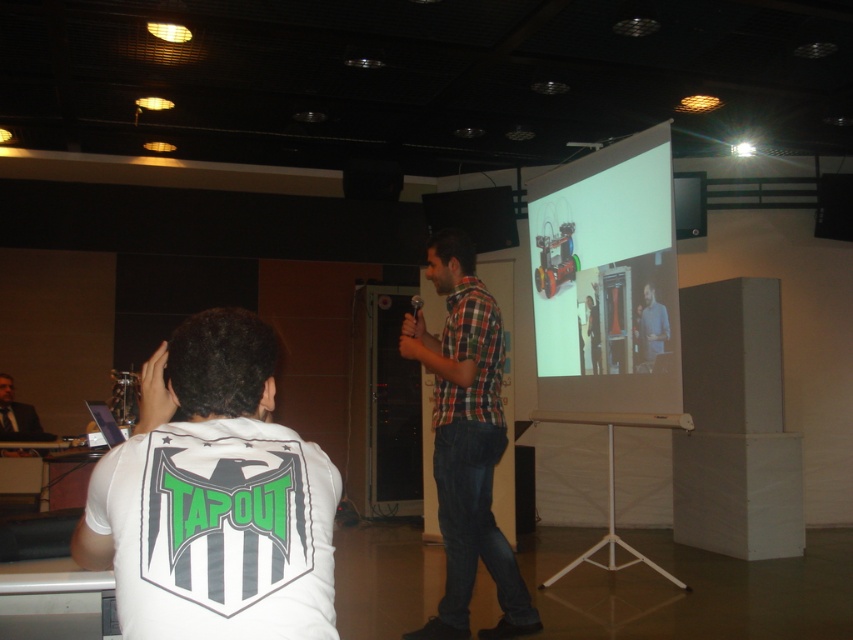
Does white matte projection screen at upper right have a smaller size compared to checkered fabric shirt at center?

No, white matte projection screen at upper right is not smaller than checkered fabric shirt at center.

Who is taller, white matte projection screen at upper right or checkered fabric shirt at center?

checkered fabric shirt at center is taller.

Where is `white matte projection screen at upper right`? white matte projection screen at upper right is located at coordinates (606, 280).

Identify the location of white matte projection screen at upper right. This screenshot has width=853, height=640. (606, 280).

Which is above, white matte shirt at lower left or black suit at left?

Positioned higher is white matte shirt at lower left.

You are a GUI agent. You are given a task and a screenshot of the screen. Output one action in this format:
    pyautogui.click(x=<x>, y=<y>)
    Task: Click on the white matte shirt at lower left
    
    Given the screenshot: What is the action you would take?
    pyautogui.click(x=213, y=497)

At what (x,y) coordinates should I click in order to perform the action: click on white matte shirt at lower left. Please return your answer as a coordinate pair (x, y). Looking at the image, I should click on (213, 497).

Between matte blue shirt at center and black suit at left, which one is positioned lower?

black suit at left is lower down.

Can you confirm if matte blue shirt at center is positioned to the right of black suit at left?

Yes, matte blue shirt at center is to the right of black suit at left.

The width and height of the screenshot is (853, 640). What are the coordinates of `matte blue shirt at center` in the screenshot? It's located at (650, 330).